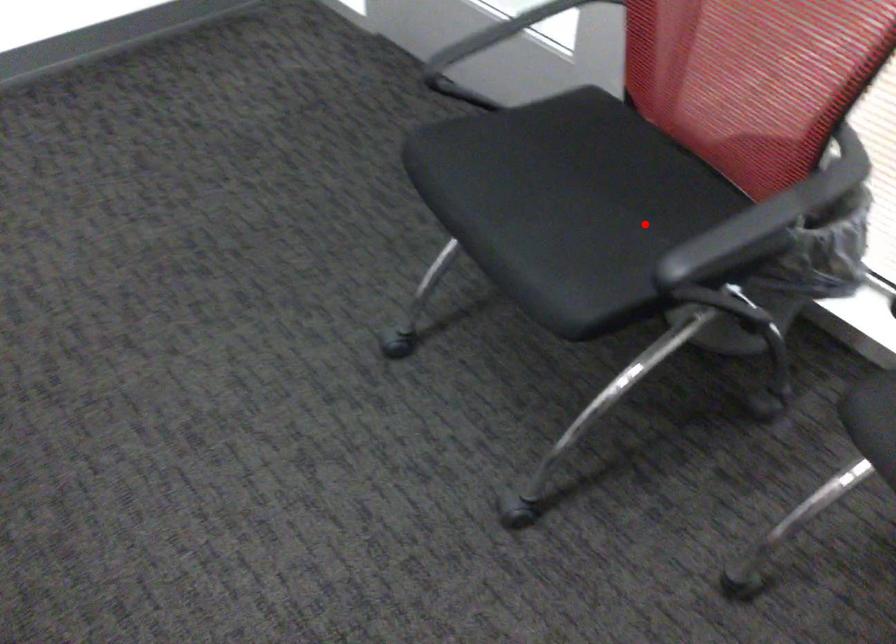
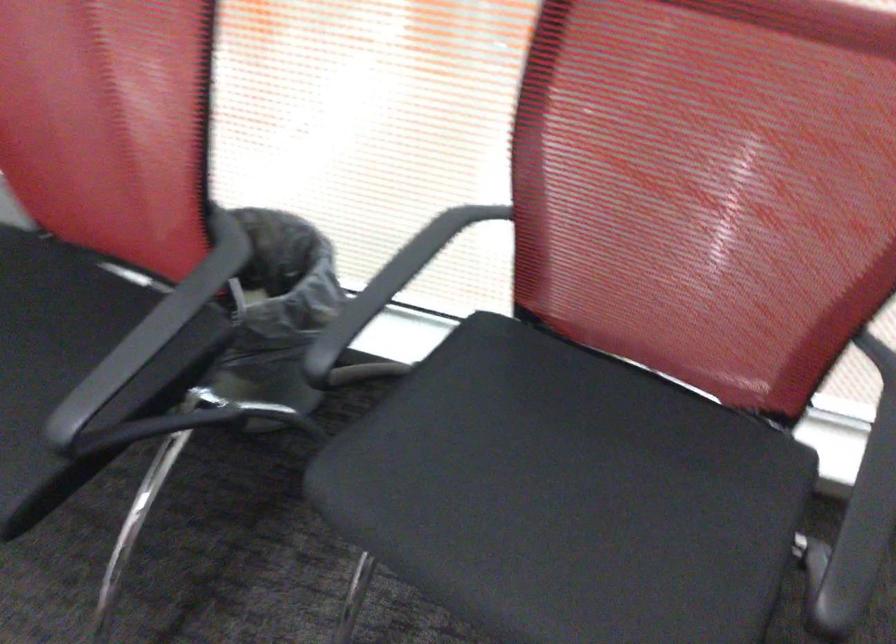
Question: I am providing you with two images of the same scene from different viewpoints. Image1 has a red point marked. In image2, the corresponding 3D location appears at what relative position? Reply with the corresponding letter.

Choices:
 (A) Closer
 (B) Farther

Answer: (A)